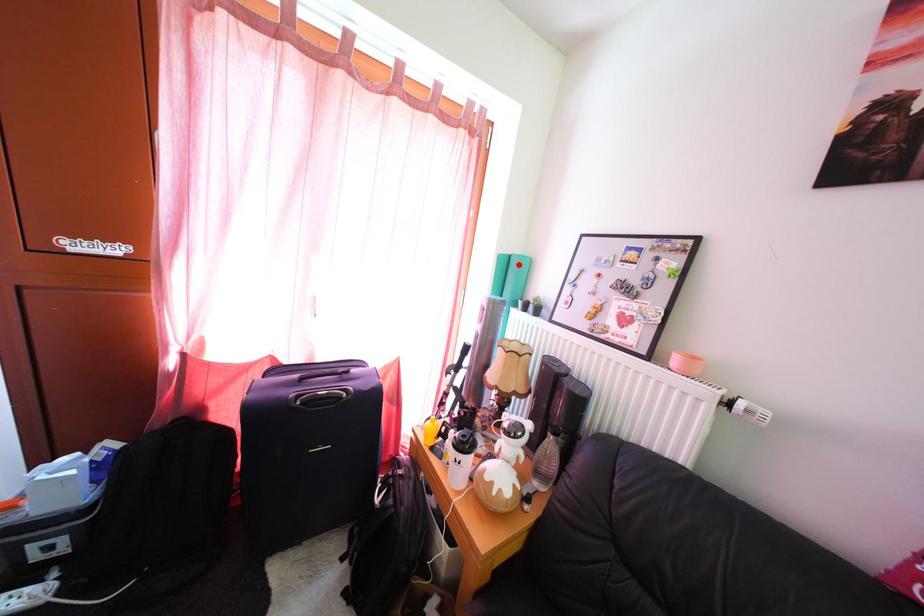
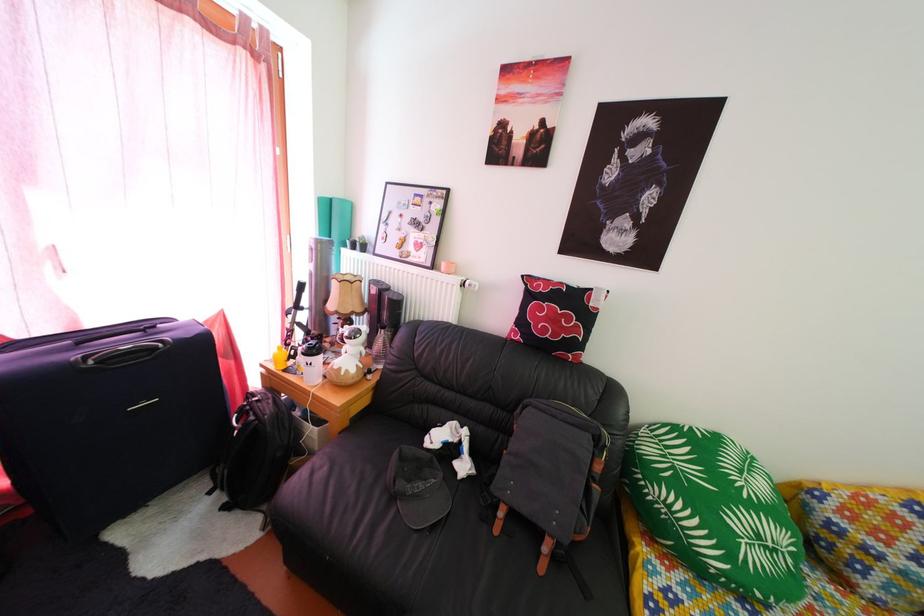
Where in the second image is the point corresponding to the highlighted location from the first image?

(339, 208)